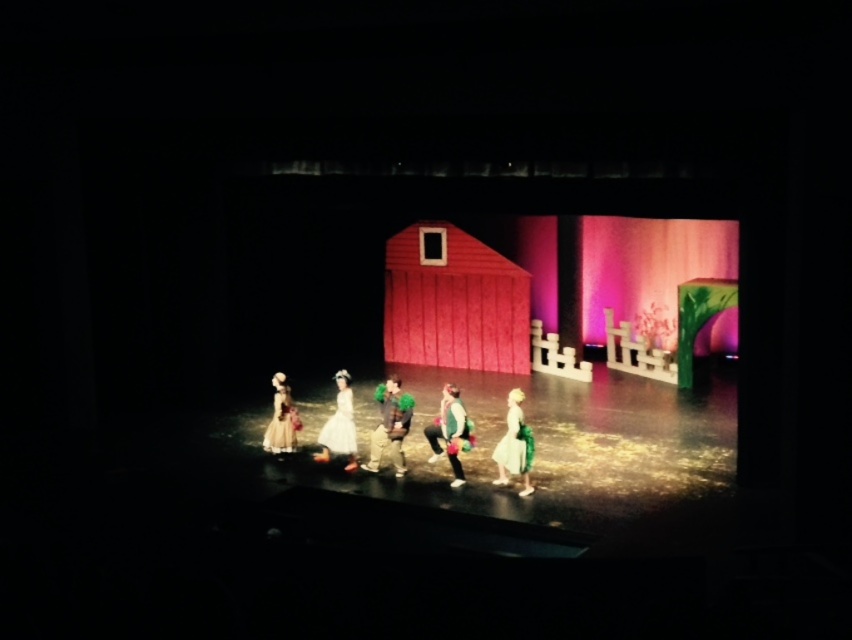
You are a stagehand responsible for ensuring all performers have enough space to move. You notice the white satin dress at center and the matte yellow dress at lower left. Which performer needs more horizontal space to avoid collisions?

The white satin dress at center requires more horizontal space because its width surpasses that of the matte yellow dress at lower right.

You are a photographer adjusting your camera to capture the stage performance. You notice two points marked on your viewfinder at coordinates point (x=528, y=461) and point (x=440, y=456). Which point should you focus on if you want to ensure the foreground elements are sharp?

You should focus on point (x=528, y=461) because it is closer to the camera than point (x=440, y=456), ensuring foreground elements are in focus.